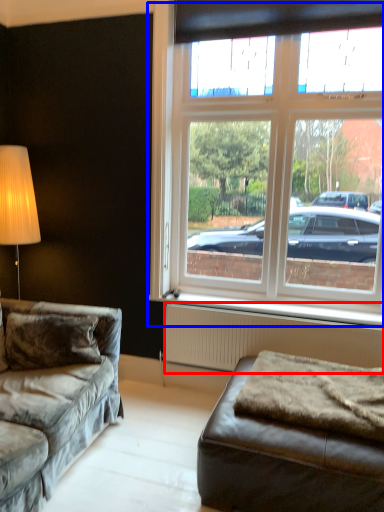
Question: Which object appears closest to the camera in this image, radiator (highlighted by a red box) or window (highlighted by a blue box)?

Choices:
 (A) radiator
 (B) window

Answer: (B)